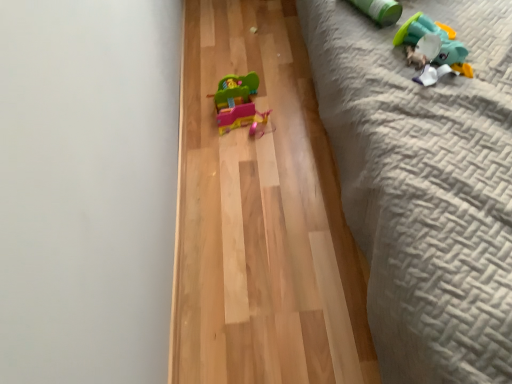
Describe the element at coordinates (380, 10) in the screenshot. This screenshot has height=384, width=512. I see `green matte cylinder at upper right, which is the 2th toy in right-to-left order` at that location.

How much space does green matte cylinder at upper right, the 2th toy when ordered from left to right, occupy horizontally?

24.19 centimeters.

Where is `plush green duck at upper right, which is the 1th toy from front to back`? plush green duck at upper right, which is the 1th toy from front to back is located at coordinates (432, 45).

In the scene shown: How much space does matte plastic toy at center, which appears as the 3th toy when viewed from the right, occupy horizontally?

matte plastic toy at center, which appears as the 3th toy when viewed from the right, is 9.44 inches wide.

The height and width of the screenshot is (384, 512). Describe the element at coordinates (424, 186) in the screenshot. I see `textured gray quilt at right` at that location.

I want to click on textured gray quilt at right, so click(x=424, y=186).

This screenshot has height=384, width=512. Describe the element at coordinates (261, 218) in the screenshot. I see `light brown wood flooring at center` at that location.

What is the approximate height of light brown wood flooring at center?

light brown wood flooring at center is 0.89 inches in height.

Where is `green matte cylinder at upper right, which is the 2th toy in right-to-left order`? The image size is (512, 384). green matte cylinder at upper right, which is the 2th toy in right-to-left order is located at coordinates (380, 10).

Looking at their sizes, would you say matte plastic toy at center, which ranks as the first toy in back-to-front order, is wider or thinner than light brown wood flooring at center?

matte plastic toy at center, which ranks as the first toy in back-to-front order, is thinner than light brown wood flooring at center.

Based on the photo, can we say matte plastic toy at center, which ranks as the first toy in back-to-front order, lies outside light brown wood flooring at center?

matte plastic toy at center, which ranks as the first toy in back-to-front order, lies outside light brown wood flooring at center's area.

Considering the relative positions of matte plastic toy at center, the third toy positioned from the front, and light brown wood flooring at center in the image provided, is matte plastic toy at center, the third toy positioned from the front, in front of light brown wood flooring at center?

That is False.

Is matte plastic toy at center, which ranks as the first toy in back-to-front order, positioned with its back to light brown wood flooring at center?

matte plastic toy at center, which ranks as the first toy in back-to-front order, is not turned away from light brown wood flooring at center.

In the scene shown: Which object is closer to the camera taking this photo, light brown wood flooring at center or plush green duck at upper right, which is the 1th toy from front to back?

light brown wood flooring at center is closer to the camera.

Which point is more forward, [234,180] or [420,24]?

The point [420,24] is closer to the camera.

How many degrees apart are the facing directions of light brown wood flooring at center and plush green duck at upper right, placed as the 1th toy when sorted from right to left?

The angle between the facing direction of light brown wood flooring at center and the facing direction of plush green duck at upper right, placed as the 1th toy when sorted from right to left, is 44.8 degrees.

From the image's perspective, relative to plush green duck at upper right, positioned as the third toy in left-to-right order, is light brown wood flooring at center above or below?

Based on their image positions, light brown wood flooring at center is located beneath plush green duck at upper right, positioned as the third toy in left-to-right order.

Is the position of plush green duck at upper right, positioned as the third toy in left-to-right order, less distant than that of green matte cylinder at upper right, the 2th toy when ordered from left to right?

Yes.

Is plush green duck at upper right, which is the 1th toy from front to back, not within green matte cylinder at upper right, the 2th toy when ordered from left to right?

Yes, plush green duck at upper right, which is the 1th toy from front to back, is located beyond the bounds of green matte cylinder at upper right, the 2th toy when ordered from left to right.

How different are the orientations of plush green duck at upper right, placed as the 1th toy when sorted from right to left, and green matte cylinder at upper right, placed as the 2th toy when sorted from front to back, in degrees?

The angular difference between plush green duck at upper right, placed as the 1th toy when sorted from right to left, and green matte cylinder at upper right, placed as the 2th toy when sorted from front to back, is 17.3 degrees.

Is plush green duck at upper right, which is the 1th toy from front to back, taller than green matte cylinder at upper right, placed as the 2th toy when sorted from front to back?

In fact, plush green duck at upper right, which is the 1th toy from front to back, may be shorter than green matte cylinder at upper right, placed as the 2th toy when sorted from front to back.

In terms of width, does green matte cylinder at upper right, placed as the 2th toy when sorted from front to back, look wider or thinner when compared to textured gray quilt at right?

In the image, green matte cylinder at upper right, placed as the 2th toy when sorted from front to back, appears to be more narrow than textured gray quilt at right.

How different are the orientations of green matte cylinder at upper right, which ranks as the 2th toy in back-to-front order, and textured gray quilt at right in degrees?

26.3 degrees separate the facing orientations of green matte cylinder at upper right, which ranks as the 2th toy in back-to-front order, and textured gray quilt at right.

Could you measure the distance between green matte cylinder at upper right, which ranks as the 2th toy in back-to-front order, and textured gray quilt at right?

The distance of green matte cylinder at upper right, which ranks as the 2th toy in back-to-front order, from textured gray quilt at right is 17.69 inches.

Which is in front, green matte cylinder at upper right, placed as the 2th toy when sorted from front to back, or textured gray quilt at right?

textured gray quilt at right is closer to the camera.

Is matte plastic toy at center, acting as the first toy starting from the left, not within plush green duck at upper right, which is the 1th toy from front to back?

Yes, matte plastic toy at center, acting as the first toy starting from the left, is located beyond the bounds of plush green duck at upper right, which is the 1th toy from front to back.

From a real-world perspective, which is physically below, matte plastic toy at center, which appears as the 3th toy when viewed from the right, or plush green duck at upper right, placed as the 1th toy when sorted from right to left?

matte plastic toy at center, which appears as the 3th toy when viewed from the right, is physically lower.

From the image's perspective, which object appears higher, matte plastic toy at center, which ranks as the first toy in back-to-front order, or plush green duck at upper right, which is the 1th toy from front to back?

plush green duck at upper right, which is the 1th toy from front to back, from the image's perspective.

Find the location of a particular element. This screenshot has width=512, height=384. toy that is the 1st object located above the matte plastic toy at center, the third toy positioned from the front (from the image's perspective) is located at coordinates (432, 45).

Is matte plastic toy at center, the third toy positioned from the front, closer to the viewer compared to green matte cylinder at upper right, which ranks as the 2th toy in back-to-front order?

No, the depth of matte plastic toy at center, the third toy positioned from the front, is greater than that of green matte cylinder at upper right, which ranks as the 2th toy in back-to-front order.

Considering the points (233, 109) and (366, 5), which point is in front, point (233, 109) or point (366, 5)?

Positioned in front is point (366, 5).

Consider the image. Is matte plastic toy at center, which appears as the 3th toy when viewed from the right, spatially inside green matte cylinder at upper right, the 2th toy when ordered from left to right, or outside of it?

matte plastic toy at center, which appears as the 3th toy when viewed from the right, is not inside green matte cylinder at upper right, the 2th toy when ordered from left to right, it's outside.

What's the angular difference between plush green duck at upper right, which is the 1th toy from front to back, and matte plastic toy at center, which ranks as the first toy in back-to-front order,'s facing directions?

46.1 degrees.

Is plush green duck at upper right, positioned as the third toy in left-to-right order, positioned with its back to matte plastic toy at center, acting as the first toy starting from the left?

plush green duck at upper right, positioned as the third toy in left-to-right order, does not have its back to matte plastic toy at center, acting as the first toy starting from the left.

Considering the positions of objects plush green duck at upper right, positioned as the third toy in left-to-right order, and matte plastic toy at center, which ranks as the first toy in back-to-front order, in the image provided, who is more to the left, plush green duck at upper right, positioned as the third toy in left-to-right order, or matte plastic toy at center, which ranks as the first toy in back-to-front order,?

From the viewer's perspective, matte plastic toy at center, which ranks as the first toy in back-to-front order, appears more on the left side.

Would you say matte plastic toy at center, the third toy positioned from the front, is part of plush green duck at upper right, positioned as the third toy in left-to-right order,'s contents?

No, plush green duck at upper right, positioned as the third toy in left-to-right order, does not contain matte plastic toy at center, the third toy positioned from the front.

Identify the location of toy located on the left of light brown wood flooring at center. This screenshot has height=384, width=512. (238, 104).

There is a light brown wood flooring at center. Identify the location of the 2nd toy above it (from a real-world perspective). click(x=432, y=45).

Based on their spatial positions, is light brown wood flooring at center or matte plastic toy at center, which ranks as the first toy in back-to-front order, further from green matte cylinder at upper right, the 2th toy when ordered from left to right?

light brown wood flooring at center lies further to green matte cylinder at upper right, the 2th toy when ordered from left to right, than the other object.

Looking at the image, which one is located closer to textured gray quilt at right, green matte cylinder at upper right, placed as the 2th toy when sorted from front to back, or matte plastic toy at center, which appears as the 3th toy when viewed from the right?

green matte cylinder at upper right, placed as the 2th toy when sorted from front to back, lies closer to textured gray quilt at right than the other object.

When comparing their distances from plush green duck at upper right, which is the 1th toy from front to back, does green matte cylinder at upper right, the 2th toy when ordered from left to right, or matte plastic toy at center, acting as the first toy starting from the left, seem further?

Based on the image, matte plastic toy at center, acting as the first toy starting from the left, appears to be further to plush green duck at upper right, which is the 1th toy from front to back.

Estimate the real-world distances between objects in this image. Which object is closer to plush green duck at upper right, which is the 1th toy from front to back, light brown wood flooring at center or textured gray quilt at right?

textured gray quilt at right.

Estimate the real-world distances between objects in this image. Which object is further from green matte cylinder at upper right, which ranks as the 2th toy in back-to-front order, matte plastic toy at center, which appears as the 3th toy when viewed from the right, or textured gray quilt at right?

Among the two, matte plastic toy at center, which appears as the 3th toy when viewed from the right, is located further to green matte cylinder at upper right, which ranks as the 2th toy in back-to-front order.

Considering their positions, is plush green duck at upper right, positioned as the third toy in left-to-right order, positioned closer to matte plastic toy at center, which appears as the 3th toy when viewed from the right, than textured gray quilt at right?

plush green duck at upper right, positioned as the third toy in left-to-right order, lies closer to matte plastic toy at center, which appears as the 3th toy when viewed from the right, than the other object.

Looking at the image, which one is located further to green matte cylinder at upper right, the 2th toy when ordered from left to right, matte plastic toy at center, which ranks as the first toy in back-to-front order, or light brown wood flooring at center?

light brown wood flooring at center lies further to green matte cylinder at upper right, the 2th toy when ordered from left to right, than the other object.

Estimate the real-world distances between objects in this image. Which object is further from green matte cylinder at upper right, the 2th toy when ordered from left to right, plush green duck at upper right, positioned as the third toy in left-to-right order, or light brown wood flooring at center?

light brown wood flooring at center lies further to green matte cylinder at upper right, the 2th toy when ordered from left to right, than the other object.

Where is `toy between light brown wood flooring at center and plush green duck at upper right, which is the 1th toy from front to back, in the horizontal direction`? The image size is (512, 384). toy between light brown wood flooring at center and plush green duck at upper right, which is the 1th toy from front to back, in the horizontal direction is located at coordinates (380, 10).

The height and width of the screenshot is (384, 512). Identify the location of toy between matte plastic toy at center, the third toy positioned from the front, and plush green duck at upper right, placed as the 1th toy when sorted from right to left, in the horizontal direction. (380, 10).

This screenshot has height=384, width=512. Identify the location of hardwood between matte plastic toy at center, which ranks as the first toy in back-to-front order, and plush green duck at upper right, which is the 1th toy from front to back, from left to right. (261, 218).

Identify the location of hardwood between textured gray quilt at right and green matte cylinder at upper right, which ranks as the 2th toy in back-to-front order, in the front-back direction. point(261,218).